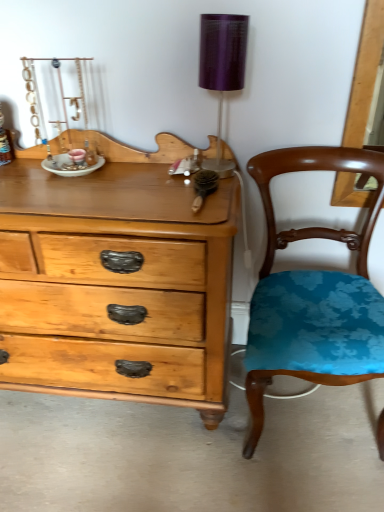
Find the location of a particular element. This screenshot has height=512, width=384. purple fabric lampshade at upper right is located at coordinates (222, 69).

Consider the image. In order to face purple fabric lampshade at upper right, should I rotate leftwards or rightwards?

It's best to rotate right around 3.986 degrees.

What do you see at coordinates (222, 69) in the screenshot? The width and height of the screenshot is (384, 512). I see `purple fabric lampshade at upper right` at bounding box center [222, 69].

Measure the distance between teal fabric chair at right and camera.

1.09 meters.

Describe the element at coordinates (313, 294) in the screenshot. I see `teal fabric chair at right` at that location.

Locate an element on the screen. The image size is (384, 512). teal fabric chair at right is located at coordinates (313, 294).

What are the coordinates of `purple fabric lampshade at upper right` in the screenshot? It's located at (222, 69).

Which object is positioned more to the left, purple fabric lampshade at upper right or teal fabric chair at right?

purple fabric lampshade at upper right.

Does purple fabric lampshade at upper right come behind teal fabric chair at right?

Yes, it is.

Is point (212, 53) closer or farther from the camera than point (256, 316)?

Point (212, 53) is positioned closer to the camera compared to point (256, 316).

From the image's perspective, is purple fabric lampshade at upper right positioned above or below teal fabric chair at right?

From the image's perspective, purple fabric lampshade at upper right appears above teal fabric chair at right.

From a real-world perspective, is purple fabric lampshade at upper right positioned over teal fabric chair at right based on gravity?

Indeed, from a real-world perspective, purple fabric lampshade at upper right stands above teal fabric chair at right.

Can you confirm if purple fabric lampshade at upper right is wider than teal fabric chair at right?

No.

Considering the sizes of objects purple fabric lampshade at upper right and teal fabric chair at right in the image provided, who is taller, purple fabric lampshade at upper right or teal fabric chair at right?

teal fabric chair at right.

Considering the relative sizes of purple fabric lampshade at upper right and teal fabric chair at right in the image provided, is purple fabric lampshade at upper right smaller than teal fabric chair at right?

Yes.

Can teal fabric chair at right be found inside purple fabric lampshade at upper right?

No, teal fabric chair at right is not inside purple fabric lampshade at upper right.

Is purple fabric lampshade at upper right next to teal fabric chair at right and touching it?

purple fabric lampshade at upper right is not next to teal fabric chair at right, and they're not touching.

Is teal fabric chair at right at the back of purple fabric lampshade at upper right?

No, purple fabric lampshade at upper right's orientation is not away from teal fabric chair at right.

Where is `chair on the right of purple fabric lampshade at upper right`? The width and height of the screenshot is (384, 512). chair on the right of purple fabric lampshade at upper right is located at coordinates (313, 294).

In the scene shown: Visually, is teal fabric chair at right positioned to the left or to the right of purple fabric lampshade at upper right?

In the image, teal fabric chair at right appears on the right side of purple fabric lampshade at upper right.

Is teal fabric chair at right further to the viewer compared to purple fabric lampshade at upper right?

No, the depth of teal fabric chair at right is less than that of purple fabric lampshade at upper right.

Considering the positions of points (332, 295) and (212, 32), is point (332, 295) closer to camera compared to point (212, 32)?

No, (332, 295) is behind (212, 32).

From the image's perspective, would you say teal fabric chair at right is positioned over purple fabric lampshade at upper right?

Incorrect, from the image's perspective, teal fabric chair at right is lower than purple fabric lampshade at upper right.

From a real-world perspective, between teal fabric chair at right and purple fabric lampshade at upper right, who is vertically lower?

From a 3D spatial view, teal fabric chair at right is below.

Can you confirm if teal fabric chair at right is thinner than purple fabric lampshade at upper right?

No, teal fabric chair at right is not thinner than purple fabric lampshade at upper right.

Consider the image. Is teal fabric chair at right taller or shorter than purple fabric lampshade at upper right?

In the image, teal fabric chair at right appears to be taller than purple fabric lampshade at upper right.

Considering the sizes of objects teal fabric chair at right and purple fabric lampshade at upper right in the image provided, who is smaller, teal fabric chair at right or purple fabric lampshade at upper right?

purple fabric lampshade at upper right.

Is teal fabric chair at right surrounding purple fabric lampshade at upper right?

No, purple fabric lampshade at upper right is not surrounded by teal fabric chair at right.

Is teal fabric chair at right next to purple fabric lampshade at upper right and touching it?

No.

Is teal fabric chair at right looking in the opposite direction of purple fabric lampshade at upper right?

teal fabric chair at right does not have its back to purple fabric lampshade at upper right.

Can you tell me how much teal fabric chair at right and purple fabric lampshade at upper right differ in facing direction?

The facing directions of teal fabric chair at right and purple fabric lampshade at upper right are 0.761 degrees apart.

Image resolution: width=384 pixels, height=512 pixels. What are the coordinates of `table lamp lying above the teal fabric chair at right (from the image's perspective)` in the screenshot? It's located at (222, 69).

Locate an element on the screen. The height and width of the screenshot is (512, 384). chair below the purple fabric lampshade at upper right (from a real-world perspective) is located at coordinates (313, 294).

Find the location of a particular element. Image resolution: width=384 pixels, height=512 pixels. table lamp to the left of teal fabric chair at right is located at coordinates (222, 69).